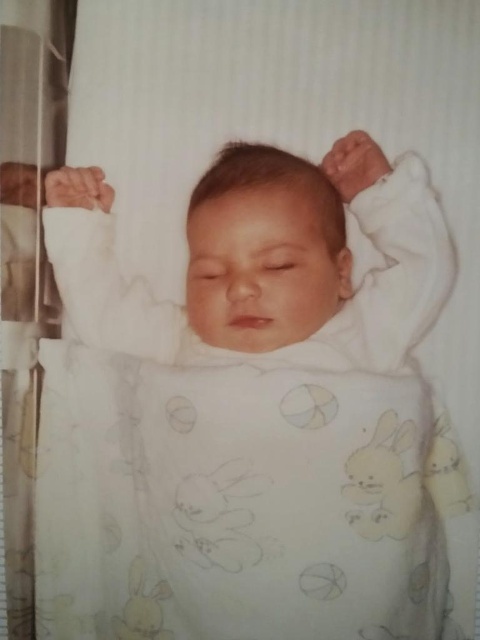
You are a nurse in a hospital nursery. You need to check the baby in the white soft newborn at center. The white soft blanket at center is covering part of the baby. Can you see the baby without moving the blanket?

The white soft blanket at center is positioned under the white soft newborn at center, so the blanket is underneath the baby. Therefore, the blanket is not covering the baby, and you can see the baby without moving the blanket.

You are a photographer adjusting the focus on a camera aimed at the sleeping baby. You notice two points of light reflected in the baby eyes. The first point is at point (323, 436) and the second is at point (400, 230). Which point should you focus on to ensure the closest reflection is sharp?

You should focus on point (323, 436) because it is closer to the viewer than point (400, 230), so it will be in sharper focus.

You are a photographer trying to capture a closeup of the baby while ensuring the white soft blanket at center is in focus. Given that the camera is 31.65 inches away from the blanket, is this distance sufficient for a clear closeup shot?

The camera is 31.65 inches away from the white soft blanket at center, so this distance should be sufficient for a clear closeup shot as most cameras can focus effectively at this range.